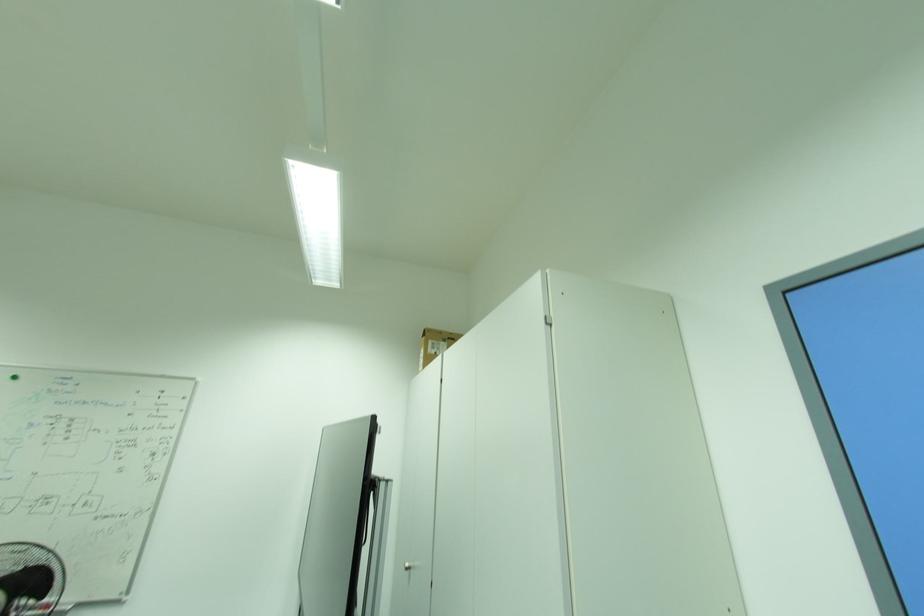
In order to click on silver cabinet handle in this screenshot , I will do `click(408, 567)`.